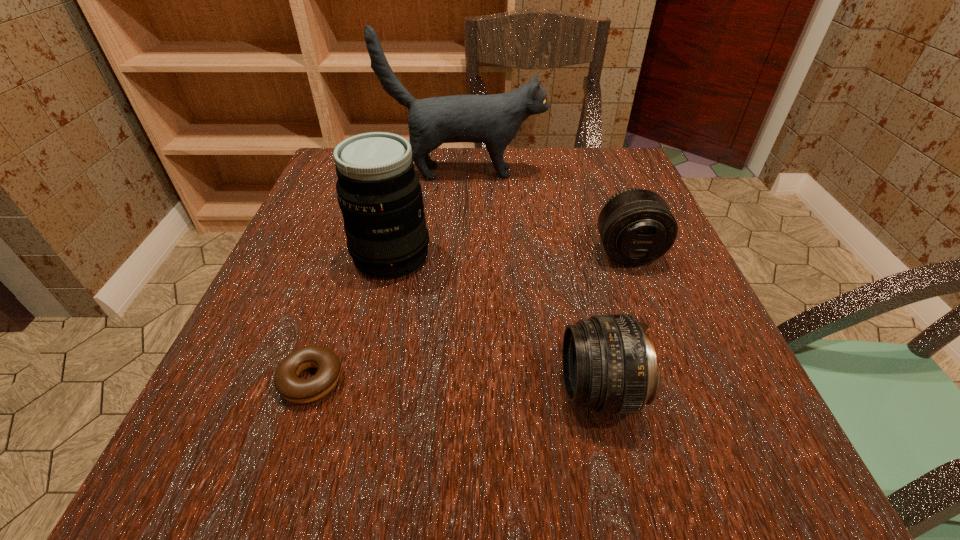
The height and width of the screenshot is (540, 960). I want to click on vacant area that lies between the leftmost telephoto lens and the nearest telephoto lens, so click(x=495, y=323).

Identify the location of object that stands as the third closest to the farthest object. Image resolution: width=960 pixels, height=540 pixels. (609, 363).

Point out which object is positioned as the nearest to the farthest object. Please provide its 2D coordinates. Your answer should be formatted as a tuple, i.e. [(x, y)], where the tuple contains the x and y coordinates of a point satisfying the conditions above.

[(379, 193)]

Identify which telephoto lens is located as the third nearest to the tallest object. Please provide its 2D coordinates. Your answer should be formatted as a tuple, i.e. [(x, y)], where the tuple contains the x and y coordinates of a point satisfying the conditions above.

[(609, 363)]

Select which telephoto lens appears as the second closest to the fourth shortest object. Please provide its 2D coordinates. Your answer should be formatted as a tuple, i.e. [(x, y)], where the tuple contains the x and y coordinates of a point satisfying the conditions above.

[(636, 226)]

Image resolution: width=960 pixels, height=540 pixels. What are the coordinates of `vacant space that satisfies the following two spatial constraints: 1. on the back side of the doughnut; 2. on the right side of the tallest telephoto lens` in the screenshot? It's located at (352, 255).